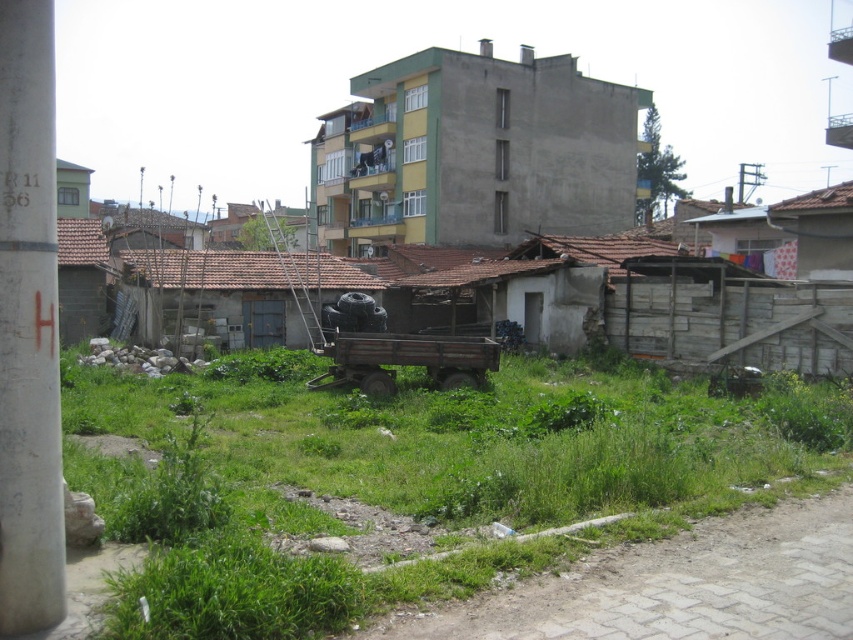
Locate an element on the screen. This screenshot has width=853, height=640. concrete building at center is located at coordinates pyautogui.click(x=473, y=152).

Who is positioned more to the left, concrete building at center or white corrugated metal hut at right?

From the viewer's perspective, concrete building at center appears more on the left side.

At what (x,y) coordinates should I click in order to perform the action: click on concrete building at center. Please return your answer as a coordinate pair (x, y). This screenshot has height=640, width=853. Looking at the image, I should click on (473, 152).

I want to click on concrete building at center, so click(x=473, y=152).

Consider the image. Is white concrete pole at left to the right of green matte hut at upper left from the viewer's perspective?

Indeed, white concrete pole at left is positioned on the right side of green matte hut at upper left.

Can you confirm if white concrete pole at left is wider than green matte hut at upper left?

No.

Is point (15, 280) less distant than point (61, 172)?

Yes, it is.

At what (x,y) coordinates should I click in order to perform the action: click on white concrete pole at left. Please return your answer as a coordinate pair (x, y). This screenshot has width=853, height=640. Looking at the image, I should click on (28, 326).

Which is more to the left, green grass at center or white corrugated metal hut at right?

From the viewer's perspective, green grass at center appears more on the left side.

Who is more distant from viewer, [323,435] or [715,225]?

Point [715,225]

Measure the distance between point (x=224, y=536) and camera.

The distance of point (x=224, y=536) from camera is 16.89 feet.

The height and width of the screenshot is (640, 853). In order to click on green grass at center in this screenshot , I will do `click(416, 476)`.